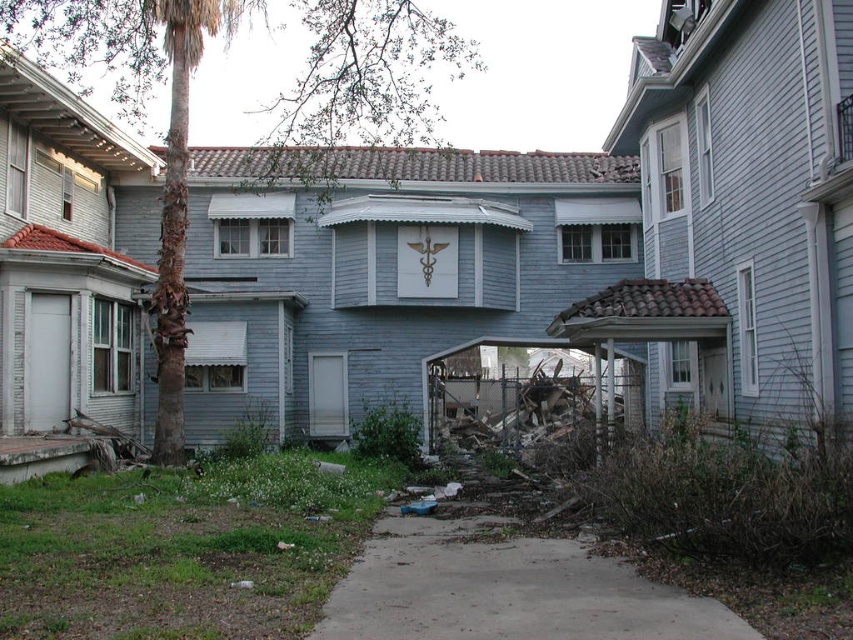
Is gray concrete pavement at center shorter than brown/scaly bark palm tree at left?

Correct, gray concrete pavement at center is not as tall as brown/scaly bark palm tree at left.

Does gray concrete pavement at center come in front of brown/scaly bark palm tree at left?

Yes, gray concrete pavement at center is in front of brown/scaly bark palm tree at left.

Identify the location of gray concrete pavement at center. (505, 589).

Find the location of a particular element. This screenshot has height=640, width=853. gray concrete pavement at center is located at coordinates (505, 589).